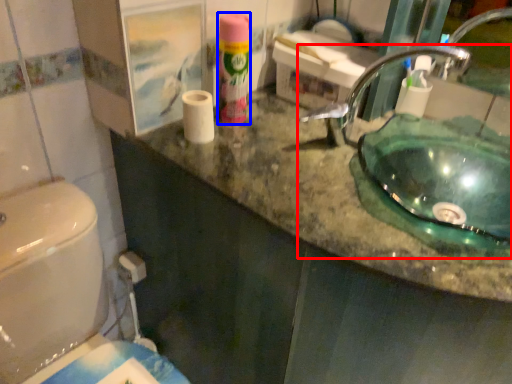
Question: Which point is closer to the camera, sink (highlighted by a red box) or cleaning product (highlighted by a blue box)?

Choices:
 (A) sink
 (B) cleaning product

Answer: (A)